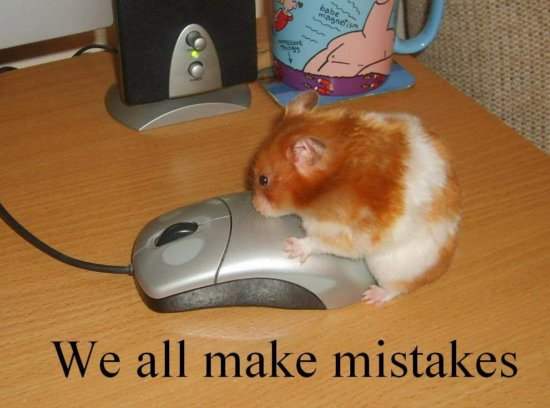
At what (x,y) coordinates should I click in order to perform the action: click on computer mouse. Please return your answer as a coordinate pair (x, y). Looking at the image, I should click on (244, 241).